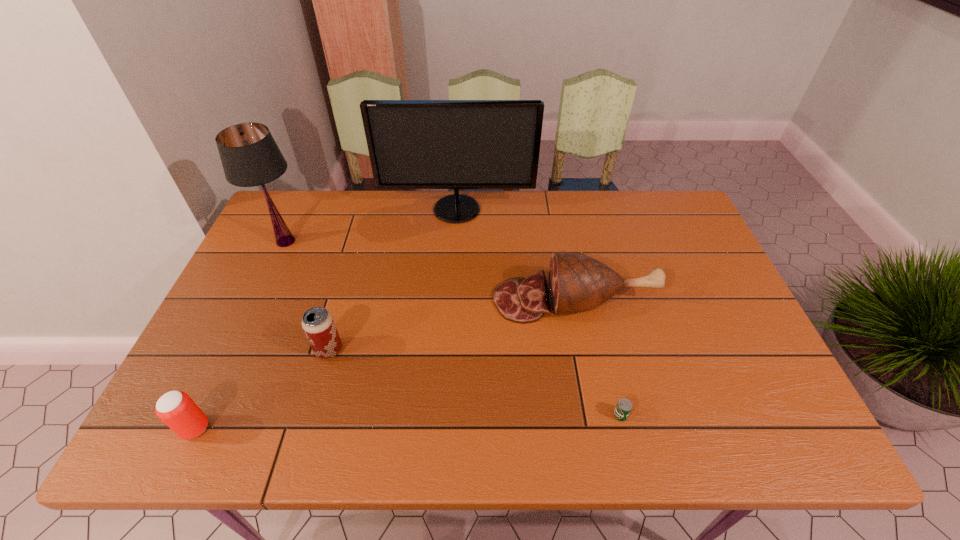
This screenshot has width=960, height=540. In order to click on computer monitor in this screenshot , I will do `click(413, 144)`.

Identify the location of the second farthest object. (250, 157).

Image resolution: width=960 pixels, height=540 pixels. What are the coordinates of `the third farthest object` in the screenshot? It's located at (577, 283).

Find the location of a particular element. The image size is (960, 540). the fourth farthest object is located at coordinates (318, 324).

I want to click on the second beer can from right to left, so click(x=318, y=324).

At what (x,y) coordinates should I click in order to perform the action: click on the leftmost beer can. Please return your answer as a coordinate pair (x, y). The height and width of the screenshot is (540, 960). Looking at the image, I should click on (176, 409).

What are the coordinates of `the shortest beer can` in the screenshot? It's located at (623, 408).

Locate an element on the screen. the rightmost beer can is located at coordinates (623, 408).

The image size is (960, 540). I want to click on vacant area situated on the front-facing side of the farthest object, so click(450, 315).

At what (x,y) coordinates should I click in order to perform the action: click on vacant space located on the front-facing side of the fifth nearest object. Please return your answer as a coordinate pair (x, y). This screenshot has height=540, width=960. Looking at the image, I should click on (383, 241).